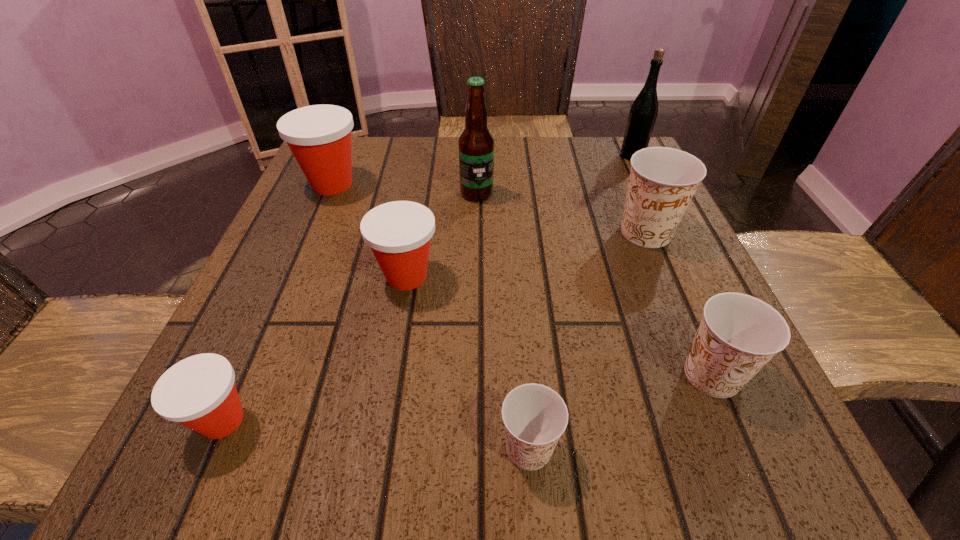
Locate an element on the screen. This screenshot has height=540, width=960. blank area located 0.390m on the back of the nearest red-orange Dixie cup is located at coordinates (311, 219).

Identify the location of free space located 0.260m on the right of the third Dixie cup from right to left. (764, 448).

I want to click on Dixie cup present at the far edge, so click(x=319, y=136).

This screenshot has width=960, height=540. In order to click on beer bottle that is at the right edge in this screenshot , I will do `click(643, 113)`.

Where is `object that is at the far left corner`? The width and height of the screenshot is (960, 540). object that is at the far left corner is located at coordinates (319, 136).

Find the location of a particular element. This screenshot has width=960, height=540. object that is at the near left corner is located at coordinates (199, 392).

The image size is (960, 540). Identify the location of object at the far right corner. (643, 113).

You are a GUI agent. You are given a task and a screenshot of the screen. Output one action in this format:
    pyautogui.click(x=<x>, y=<y>)
    Task: Click on the vacant space at the far edge
    
    Given the screenshot: What is the action you would take?
    pyautogui.click(x=569, y=188)

In the image, there is a desktop. At what (x,y) coordinates should I click in order to perform the action: click on vacant space at the left edge. Please return your answer as a coordinate pair (x, y). The height and width of the screenshot is (540, 960). Looking at the image, I should click on (261, 394).

Find the location of a particular element. Image resolution: width=960 pixels, height=540 pixels. free space at the right edge of the desktop is located at coordinates (660, 278).